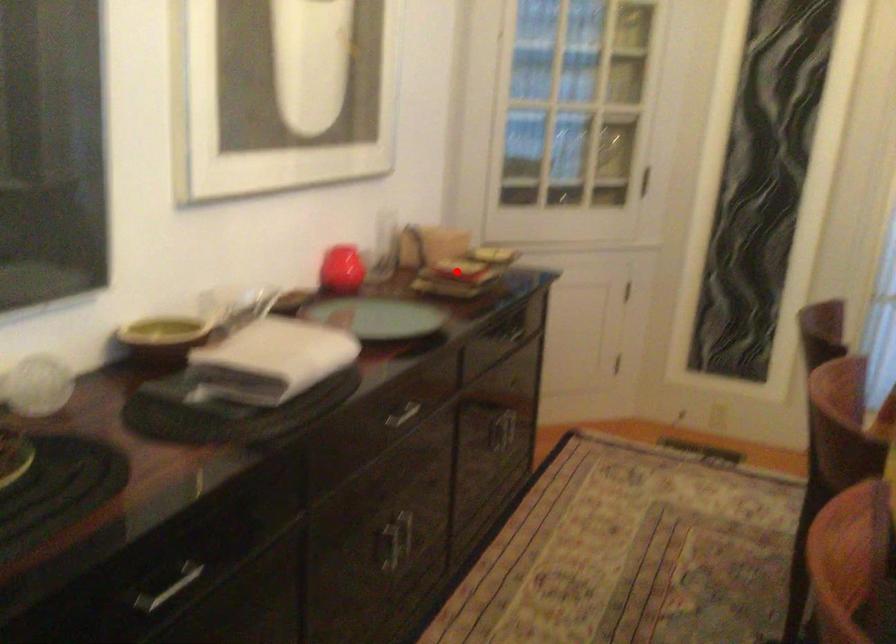
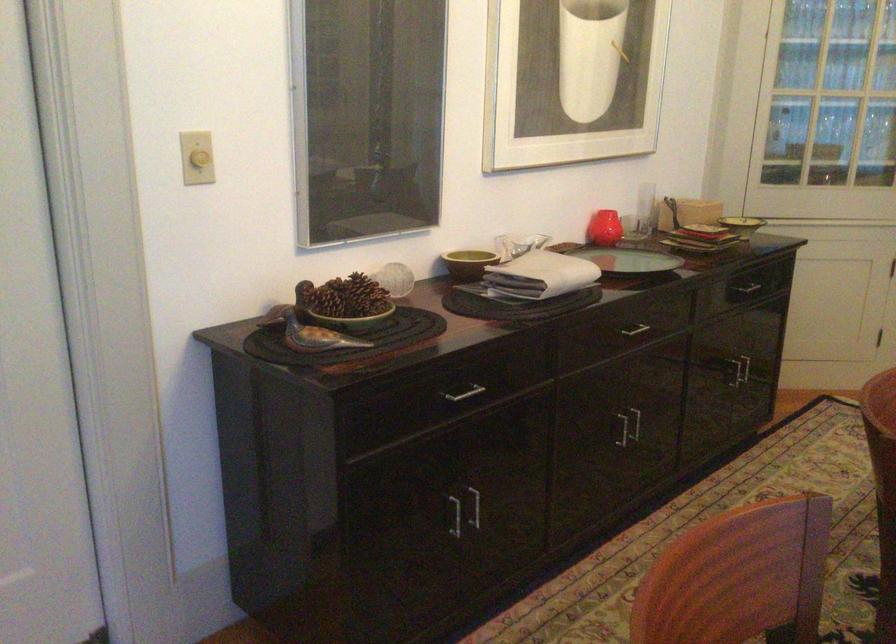
In the second image, find the point that corresponds to the highlighted location in the first image.

(704, 230)